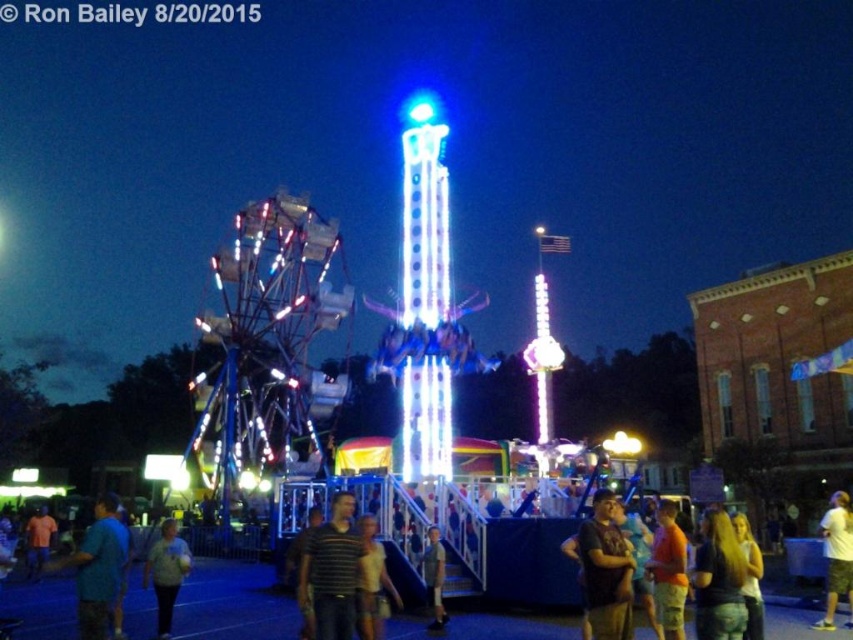
Does brown cotton shirt at center lie in front of light brown leather jacket at center?

That is True.

Can you confirm if brown cotton shirt at center is thinner than light brown leather jacket at center?

In fact, brown cotton shirt at center might be wider than light brown leather jacket at center.

Is point (625, 588) farther from camera compared to point (440, 570)?

No, (625, 588) is closer to viewer.

This screenshot has height=640, width=853. Find the location of `brown cotton shirt at center`. brown cotton shirt at center is located at coordinates point(606,570).

Between blonde hair at lower right and white cotton shirt at lower right, which one appears on the right side from the viewer's perspective?

Positioned to the right is white cotton shirt at lower right.

Is blonde hair at lower right to the left of white cotton shirt at lower right from the viewer's perspective?

Indeed, blonde hair at lower right is positioned on the left side of white cotton shirt at lower right.

Identify the location of blonde hair at lower right. The image size is (853, 640). (718, 579).

Who is positioned more to the left, blonde hair at lower right or blue cotton shirt at lower left?

From the viewer's perspective, blue cotton shirt at lower left appears more on the left side.

Can you confirm if blonde hair at lower right is thinner than blue cotton shirt at lower left?

Indeed, blonde hair at lower right has a lesser width compared to blue cotton shirt at lower left.

Describe the element at coordinates (718, 579) in the screenshot. Image resolution: width=853 pixels, height=640 pixels. I see `blonde hair at lower right` at that location.

Locate an element on the screen. The width and height of the screenshot is (853, 640). blonde hair at lower right is located at coordinates (718, 579).